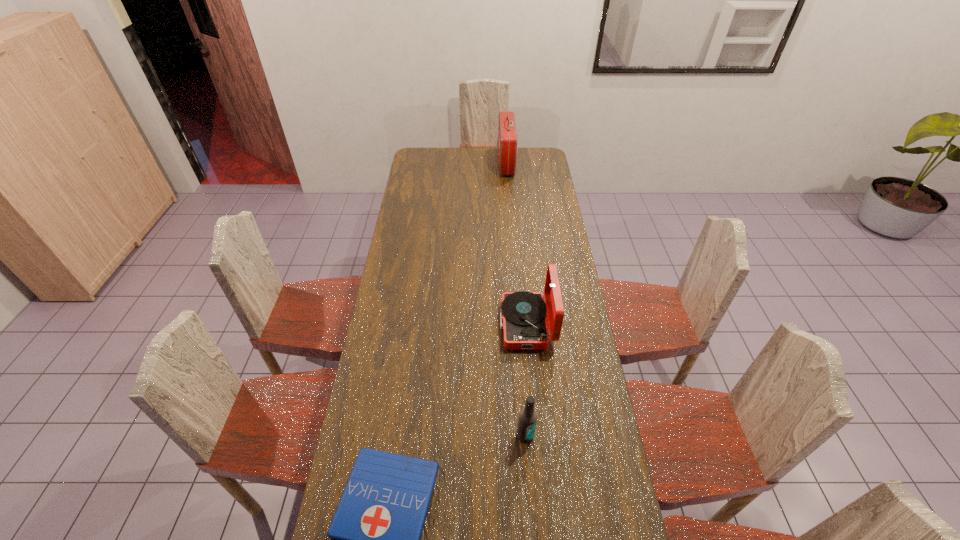
In order to click on vacant space in between the beer bottle and the second farthest object in this screenshot , I will do 526,380.

Locate an element on the screen. The height and width of the screenshot is (540, 960). free space between the second farthest object and the second nearest object is located at coordinates (526, 380).

The image size is (960, 540). Find the location of `object that is the second closest to the phonograph_record`. object that is the second closest to the phonograph_record is located at coordinates (377, 527).

Locate which object ranks second in proximity to the second farthest object. Please provide its 2D coordinates. Your answer should be formatted as a tuple, i.e. [(x, y)], where the tuple contains the x and y coordinates of a point satisfying the conditions above.

[(377, 527)]

This screenshot has height=540, width=960. What are the coordinates of `free space that satisfies the following two spatial constraints: 1. on the side of the right first-aid kit with the first aid cross symbol; 2. on the label of the second nearest object` in the screenshot? It's located at (528, 435).

You are a GUI agent. You are given a task and a screenshot of the screen. Output one action in this format:
    pyautogui.click(x=<x>, y=<y>)
    Task: Click on the vacant space that satisfies the following two spatial constraints: 1. on the front-facing side of the third nearest object; 2. on the label of the beer bottle
    
    Given the screenshot: What is the action you would take?
    pyautogui.click(x=538, y=435)

I want to click on vacant space that satisfies the following two spatial constraints: 1. on the front-facing side of the phonograph_record; 2. on the label of the third farthest object, so click(538, 435).